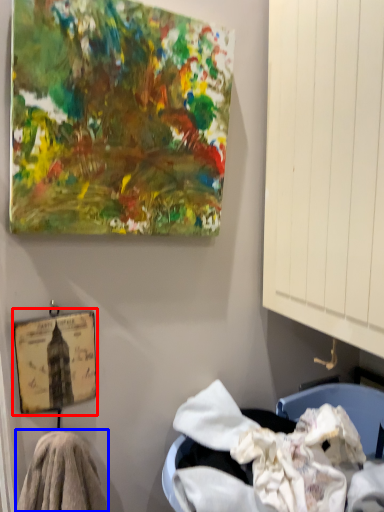
Question: Among these objects, which one is farthest to the camera, picture frame (highlighted by a red box) or material (highlighted by a blue box)?

Choices:
 (A) picture frame
 (B) material

Answer: (A)